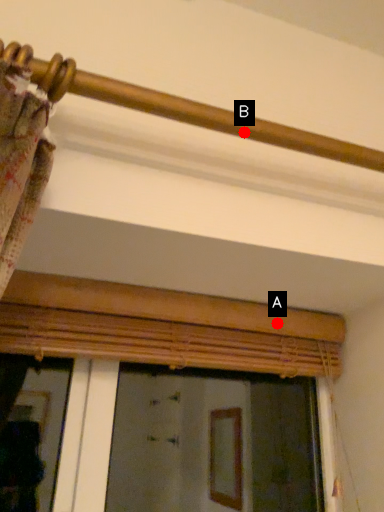
Question: Two points are circled on the image, labeled by A and B beside each circle. Which point appears closest to the camera in this image?

Choices:
 (A) A is closer
 (B) B is closer

Answer: (B)